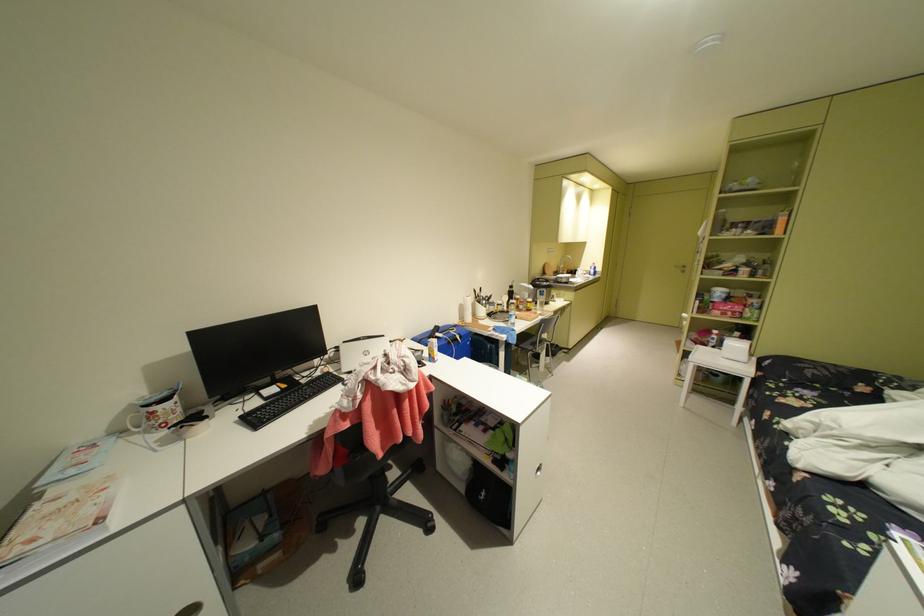
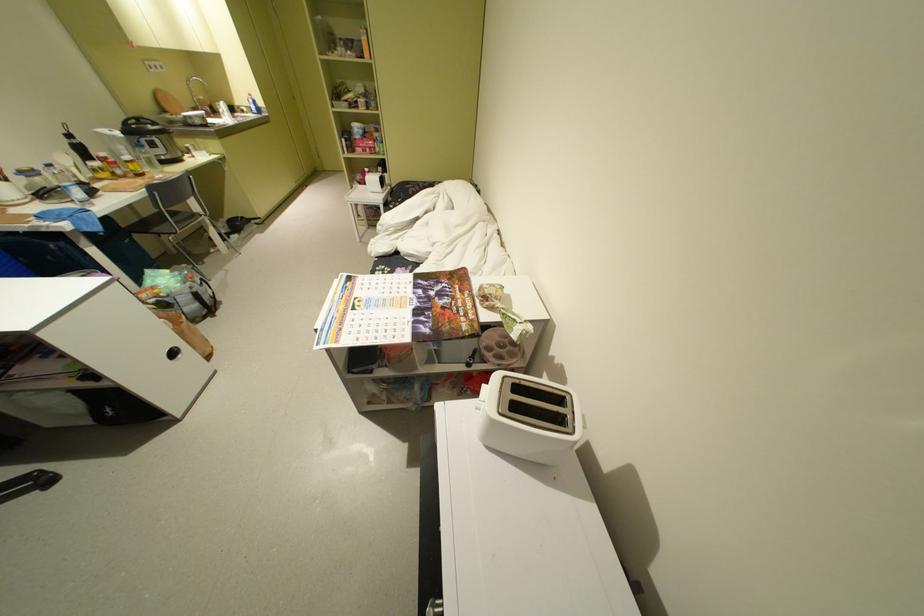
The images are taken continuously from a first-person perspective. In which direction is your viewpoint rotating?

The camera's rotation is toward right-down.